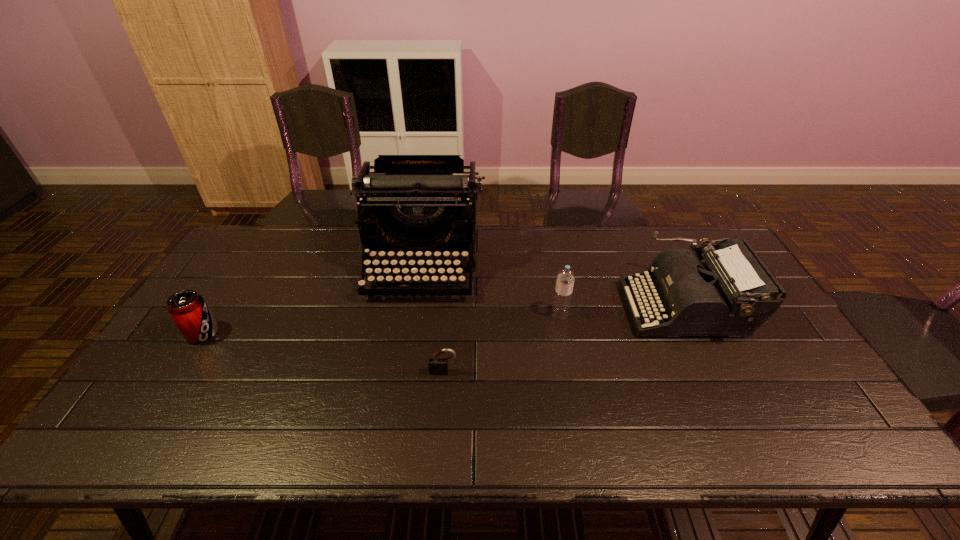
In the image, there is a desktop. Where is `vacant space at the near edge`? This screenshot has height=540, width=960. vacant space at the near edge is located at coordinates (644, 441).

Image resolution: width=960 pixels, height=540 pixels. I want to click on vacant space at the left edge, so click(x=214, y=355).

This screenshot has height=540, width=960. Identify the location of free spot at the right edge of the desktop. (784, 366).

Where is `empty space between the shortest object and the soda can`? This screenshot has height=540, width=960. empty space between the shortest object and the soda can is located at coordinates (324, 353).

Identify the location of free spot between the second shortest object and the right typewriter. (444, 320).

Identify the location of unoccupied area between the left typewriter and the fourth object from left to right. The height and width of the screenshot is (540, 960). (492, 291).

Image resolution: width=960 pixels, height=540 pixels. Identify the location of free space between the right typewriter and the water bottle. 622,310.

Locate an element on the screen. free space that is in between the right typewriter and the second shortest object is located at coordinates (444, 320).

Locate an element on the screen. The image size is (960, 540). empty space between the right typewriter and the soda can is located at coordinates (444, 320).

You are a GUI agent. You are given a task and a screenshot of the screen. Output one action in this format:
    pyautogui.click(x=<x>, y=<y>)
    Task: Click on the free space between the soda can and the rightmost object
    The height and width of the screenshot is (540, 960).
    Given the screenshot: What is the action you would take?
    pyautogui.click(x=444, y=320)